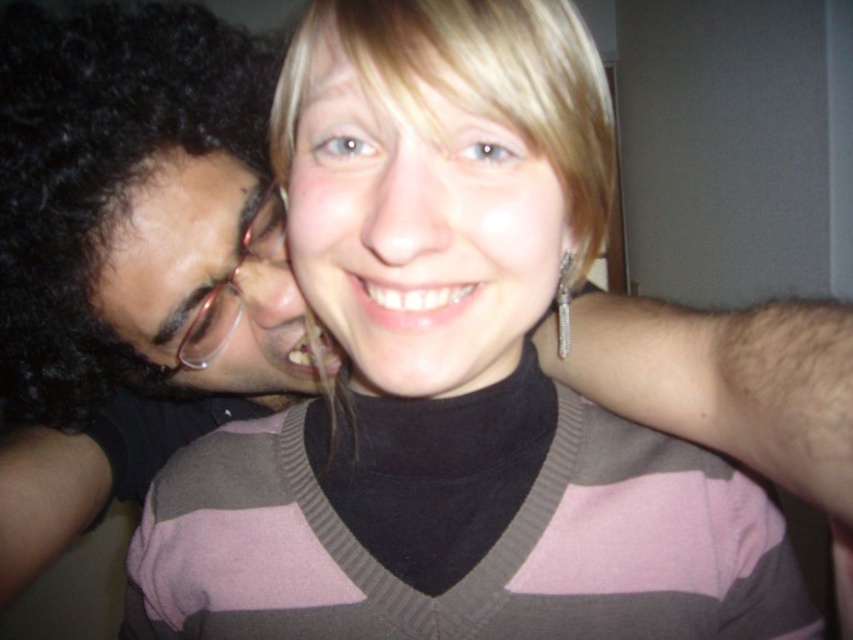
Looking at this image, does blonde hair at center appear under matte black glasses at left?

No.

Who is positioned more to the left, blonde hair at center or matte black glasses at left?

matte black glasses at left

Does point (335, 168) come farther from viewer compared to point (277, 314)?

No, (335, 168) is in front of (277, 314).

Where is `blonde hair at center`? blonde hair at center is located at coordinates (416, 221).

Can you confirm if matte black hair at left is positioned below matte black glasses at left?

Actually, matte black hair at left is above matte black glasses at left.

Does matte black hair at left lie in front of matte black glasses at left?

Yes, matte black hair at left is in front of matte black glasses at left.

Find the location of `matte black hair at left`. matte black hair at left is located at coordinates (131, 257).

The height and width of the screenshot is (640, 853). I want to click on matte black hair at left, so [x=131, y=257].

Is matte black hair at left further to camera compared to blonde hair at center?

Yes, matte black hair at left is further from the viewer.

Which is below, matte black hair at left or blonde hair at center?

matte black hair at left is lower down.

Locate an element on the screen. matte black hair at left is located at coordinates pyautogui.click(x=131, y=257).